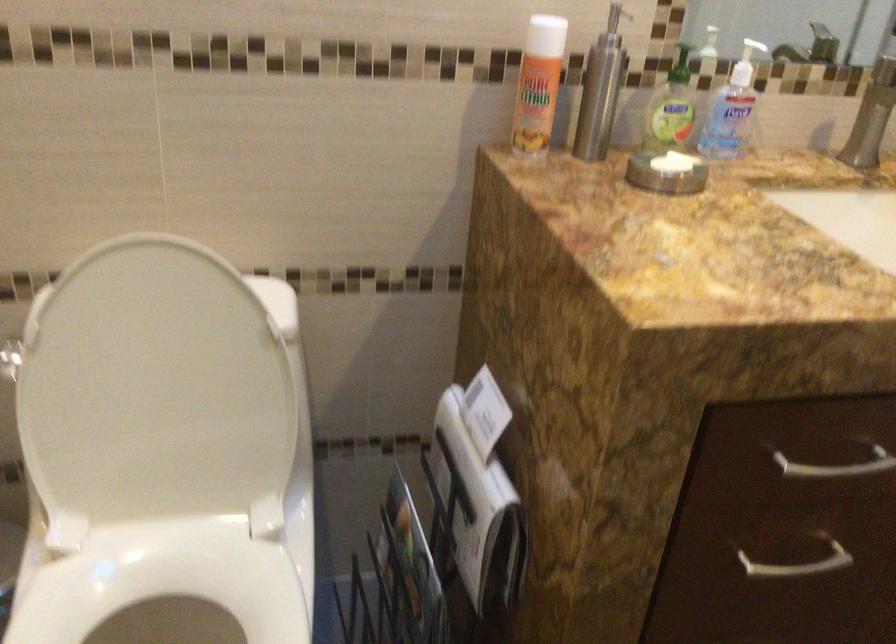
The image size is (896, 644). I want to click on silver dispenser pump, so click(615, 17).